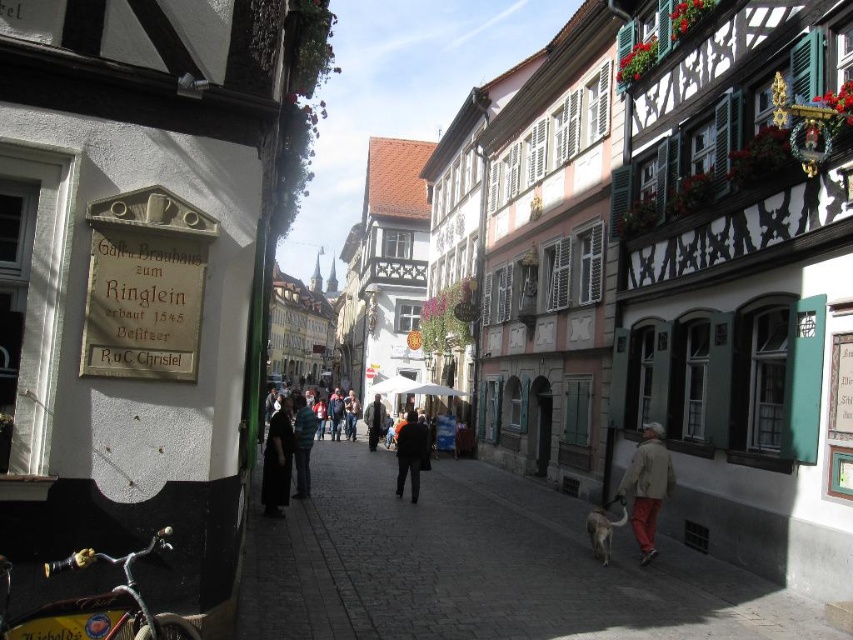
Question: Is light brown jacket at lower right positioned behind dark gray jacket at center?

Choices:
 (A) no
 (B) yes

Answer: (A)

Question: Which point appears closest to the camera in this image?

Choices:
 (A) (376, 413)
 (B) (412, 476)
 (C) (646, 529)
 (D) (283, 404)

Answer: (C)

Question: Among these objects, which one is nearest to the camera?

Choices:
 (A) light brown wooden sidewalk at center
 (B) dark fabric coat at center

Answer: (A)

Question: From the image, what is the correct spatial relationship of light brown jacket at lower right in relation to dark blue jacket at center?

Choices:
 (A) left
 (B) right

Answer: (B)

Question: Which point is closer to the camera?

Choices:
 (A) (374, 440)
 (B) (426, 467)
 (C) (479, 484)

Answer: (B)

Question: Observing the image, what is the correct spatial positioning of light brown jacket at lower right in reference to dark blue jacket at center?

Choices:
 (A) left
 (B) right

Answer: (B)